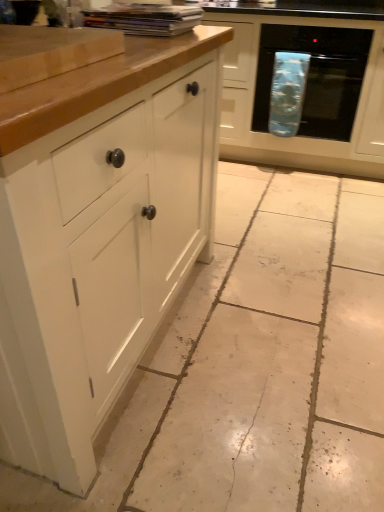
Question: Is matte white cabinet at center, the 1th cabinetry positioned from the right, taller than white tile floor at center?

Choices:
 (A) no
 (B) yes

Answer: (B)

Question: Can you confirm if matte white cabinet at center, marked as the second cabinetry in a front-to-back arrangement, is thinner than white tile floor at center?

Choices:
 (A) yes
 (B) no

Answer: (A)

Question: From a real-world perspective, is matte white cabinet at center, the 1th cabinetry from the back, beneath white tile floor at center?

Choices:
 (A) yes
 (B) no

Answer: (B)

Question: Can you confirm if matte white cabinet at center, the 1th cabinetry positioned from the right, is smaller than white tile floor at center?

Choices:
 (A) no
 (B) yes

Answer: (A)

Question: Is matte white cabinet at center, the second cabinetry viewed from the left, at the right side of white tile floor at center?

Choices:
 (A) yes
 (B) no

Answer: (A)

Question: In terms of height, does white matte cabinet at left, the second cabinetry viewed from the right, look taller or shorter compared to white tile floor at center?

Choices:
 (A) short
 (B) tall

Answer: (B)

Question: From a real-world perspective, relative to white tile floor at center, is white matte cabinet at left, acting as the 2th cabinetry starting from the back, vertically above or below?

Choices:
 (A) below
 (B) above

Answer: (B)

Question: Visually, is white matte cabinet at left, acting as the 2th cabinetry starting from the back, positioned to the left or to the right of white tile floor at center?

Choices:
 (A) left
 (B) right

Answer: (A)

Question: Considering their positions, is white matte cabinet at left, the second cabinetry viewed from the right, located in front of or behind white tile floor at center?

Choices:
 (A) front
 (B) behind

Answer: (A)

Question: Relative to blue fabric oven at right, is white tile floor at center in front or behind?

Choices:
 (A) front
 (B) behind

Answer: (A)

Question: Is white tile floor at center to the left or to the right of blue fabric oven at right in the image?

Choices:
 (A) right
 (B) left

Answer: (B)

Question: From their relative heights in the image, would you say white tile floor at center is taller or shorter than blue fabric oven at right?

Choices:
 (A) short
 (B) tall

Answer: (A)

Question: Is white tile floor at center spatially inside blue fabric oven at right, or outside of it?

Choices:
 (A) outside
 (B) inside

Answer: (A)

Question: Looking at their shapes, would you say matte white cabinet at center, marked as the second cabinetry in a front-to-back arrangement, is wider or thinner than white tile floor at center?

Choices:
 (A) thin
 (B) wide

Answer: (A)

Question: Is matte white cabinet at center, the second cabinetry viewed from the left, bigger or smaller than white tile floor at center?

Choices:
 (A) small
 (B) big

Answer: (B)